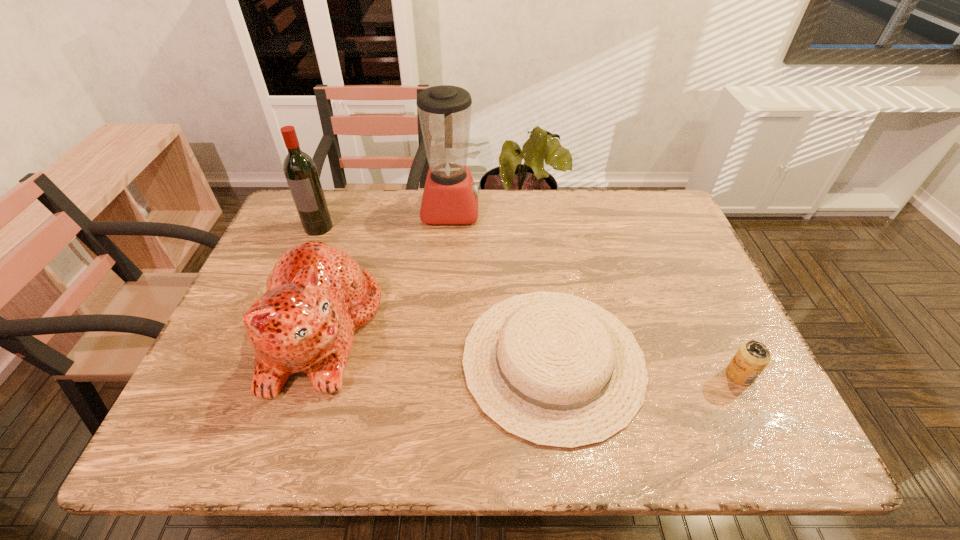
Locate an element on the screen. The width and height of the screenshot is (960, 540). free space between the beer can and the shortest object is located at coordinates (646, 368).

Image resolution: width=960 pixels, height=540 pixels. I want to click on object identified as the second closest to the second tallest object, so click(450, 196).

Choose which object is the fourth nearest neighbor to the rightmost object. Please provide its 2D coordinates. Your answer should be formatted as a tuple, i.e. [(x, y)], where the tuple contains the x and y coordinates of a point satisfying the conditions above.

[(300, 170)]

At what (x,y) coordinates should I click in order to perform the action: click on vacant region that satisfies the following two spatial constraints: 1. on the front of the blender near the controls; 2. on the label of the second tallest object. Please return your answer as a coordinate pair (x, y). Looking at the image, I should click on (449, 227).

At what (x,y) coordinates should I click in order to perform the action: click on free space that satisfies the following two spatial constraints: 1. on the front of the sunhat near the controls; 2. on the right side of the tallest object. Please return your answer as a coordinate pair (x, y). The image size is (960, 540). Looking at the image, I should click on (439, 361).

Locate an element on the screen. vacant position in the image that satisfies the following two spatial constraints: 1. on the front of the blender near the controls; 2. on the label of the fourth shortest object is located at coordinates (449, 227).

Where is `vacant space that satisfies the following two spatial constraints: 1. on the front side of the shortest object; 2. on the right side of the fourth tallest object`? vacant space that satisfies the following two spatial constraints: 1. on the front side of the shortest object; 2. on the right side of the fourth tallest object is located at coordinates (555, 375).

Locate an element on the screen. blank area in the image that satisfies the following two spatial constraints: 1. on the front of the sunhat near the controls; 2. on the left side of the tallest object is located at coordinates click(x=439, y=361).

The width and height of the screenshot is (960, 540). Find the location of `free region that satisfies the following two spatial constraints: 1. on the face of the shortest object; 2. on the right side of the third tallest object`. free region that satisfies the following two spatial constraints: 1. on the face of the shortest object; 2. on the right side of the third tallest object is located at coordinates (311, 361).

At what (x,y) coordinates should I click in order to perform the action: click on vacant space that satisfies the following two spatial constraints: 1. on the face of the shortest object; 2. on the left side of the third tallest object. Please return your answer as a coordinate pair (x, y). Looking at the image, I should click on (311, 361).